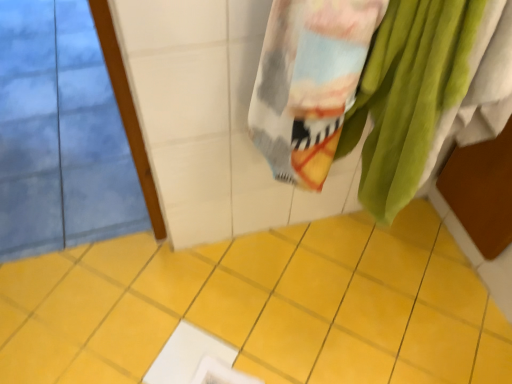
Question: Considering the relative sizes of soft cotton towel at upper right and yellow ceramic tile at center in the image provided, is soft cotton towel at upper right shorter than yellow ceramic tile at center?

Choices:
 (A) no
 (B) yes

Answer: (A)

Question: Is soft cotton towel at upper right in contact with yellow ceramic tile at center?

Choices:
 (A) no
 (B) yes

Answer: (A)

Question: Is soft cotton towel at upper right positioned with its back to yellow ceramic tile at center?

Choices:
 (A) no
 (B) yes

Answer: (A)

Question: From a real-world perspective, is soft cotton towel at upper right physically above yellow ceramic tile at center?

Choices:
 (A) no
 (B) yes

Answer: (B)

Question: Does soft cotton towel at upper right come in front of yellow ceramic tile at center?

Choices:
 (A) no
 (B) yes

Answer: (B)

Question: Considering the relative positions of soft cotton towel at upper right and yellow ceramic tile at center in the image provided, is soft cotton towel at upper right to the right of yellow ceramic tile at center from the viewer's perspective?

Choices:
 (A) yes
 (B) no

Answer: (A)

Question: Is yellow ceramic tile at center far away from soft cotton towel at upper right?

Choices:
 (A) yes
 (B) no

Answer: (B)

Question: Is yellow ceramic tile at center positioned beyond the bounds of soft cotton towel at upper right?

Choices:
 (A) no
 (B) yes

Answer: (B)

Question: Does yellow ceramic tile at center have a larger size compared to soft cotton towel at upper right?

Choices:
 (A) yes
 (B) no

Answer: (B)

Question: Is yellow ceramic tile at center closer to the viewer compared to soft cotton towel at upper right?

Choices:
 (A) no
 (B) yes

Answer: (A)

Question: Does yellow ceramic tile at center touch soft cotton towel at upper right?

Choices:
 (A) no
 (B) yes

Answer: (A)

Question: From a real-world perspective, is yellow ceramic tile at center positioned under soft cotton towel at upper right based on gravity?

Choices:
 (A) yes
 (B) no

Answer: (A)

Question: From a real-world perspective, relative to yellow ceramic tile at center, is soft cotton towel at upper right vertically above or below?

Choices:
 (A) below
 (B) above

Answer: (B)